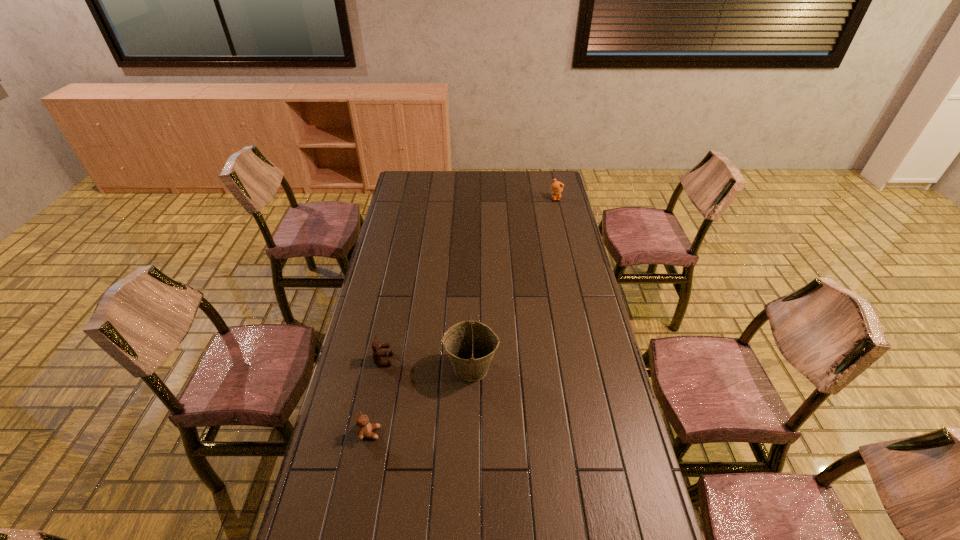
You are a GUI agent. You are given a task and a screenshot of the screen. Output one action in this format:
    pyautogui.click(x=<x>, y=<y>)
    Task: Click on the third object from left to right
    This screenshot has width=960, height=540.
    Given the screenshot: What is the action you would take?
    pyautogui.click(x=470, y=345)

Image resolution: width=960 pixels, height=540 pixels. In order to click on wine bucket in this screenshot , I will do `click(470, 345)`.

This screenshot has height=540, width=960. Identify the location of the farthest object. (557, 187).

Where is `the farthest teddy bear`? the farthest teddy bear is located at coordinates (557, 187).

This screenshot has width=960, height=540. Find the location of `the second nearest teddy bear`. the second nearest teddy bear is located at coordinates (377, 354).

Locate an element on the screen. Image resolution: width=960 pixels, height=540 pixels. the nearest object is located at coordinates (364, 429).

You are a GUI agent. You are given a task and a screenshot of the screen. Output one action in this format:
    pyautogui.click(x=<x>, y=<y>)
    Task: Click on the vacant space located 0.080m on the front of the second object from right to left
    Image resolution: width=960 pixels, height=540 pixels.
    Given the screenshot: What is the action you would take?
    pyautogui.click(x=470, y=410)

Where is `free point located on the face of the farthest teddy bear`? The height and width of the screenshot is (540, 960). free point located on the face of the farthest teddy bear is located at coordinates (565, 242).

Locate an element on the screen. This screenshot has height=540, width=960. vacant space positioned 0.060m on the face of the second farthest teddy bear is located at coordinates (410, 360).

At what (x,y) coordinates should I click in order to perform the action: click on free space located 0.290m on the front-facing side of the nearest object. Please return your answer as a coordinate pair (x, y). The height and width of the screenshot is (540, 960). Looking at the image, I should click on [475, 433].